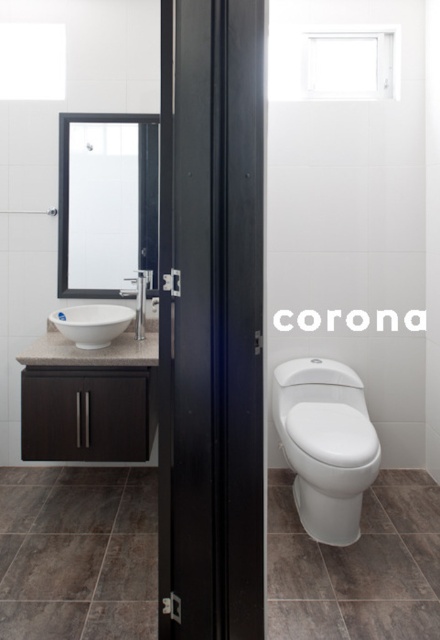
Which is above, clear glass mirror at upper left or white glossy toilet at center?

clear glass mirror at upper left is higher up.

Is clear glass mirror at upper left positioned behind white glossy toilet at center?

Yes, clear glass mirror at upper left is behind white glossy toilet at center.

What do you see at coordinates (106, 202) in the screenshot?
I see `clear glass mirror at upper left` at bounding box center [106, 202].

Identify the location of clear glass mirror at upper left. point(106,202).

Measure the distance between clear glass mirror at upper left and camera.

The distance of clear glass mirror at upper left from camera is 3.08 meters.

Find the location of `clear glass mirror at upper left`. clear glass mirror at upper left is located at coordinates (106, 202).

Can you confirm if white glossy toilet at center is bigger than matte silver faucet at upper left?

Indeed, white glossy toilet at center has a larger size compared to matte silver faucet at upper left.

Looking at this image, does white glossy toilet at center have a lesser height compared to matte silver faucet at upper left?

In fact, white glossy toilet at center may be taller than matte silver faucet at upper left.

Between point (319, 401) and point (135, 305), which one is positioned in front?

Point (319, 401) is in front.

Where is `white glossy toilet at center`? white glossy toilet at center is located at coordinates (326, 444).